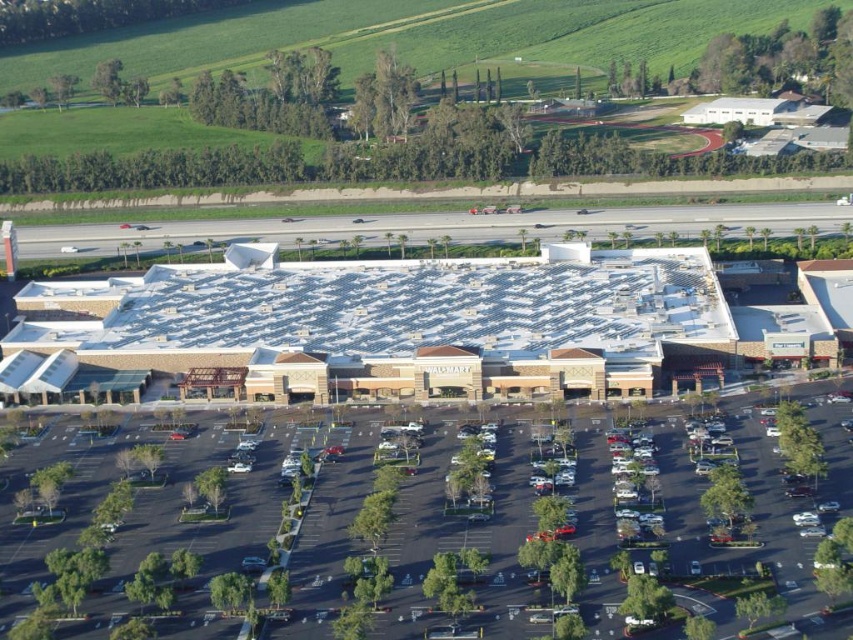
Question: Can you confirm if brown stone building at center is smaller than black asphalt parking lot at center?

Choices:
 (A) no
 (B) yes

Answer: (A)

Question: Which point is closer to the camera taking this photo?

Choices:
 (A) (672, 220)
 (B) (155, 497)
 (C) (193, 307)

Answer: (B)

Question: Among these objects, which one is farthest from the camera?

Choices:
 (A) brown stone building at center
 (B) black asphalt parking lot at center
 (C) dark gray asphalt parking lot at center

Answer: (C)

Question: Does brown stone building at center lie behind black asphalt parking lot at center?

Choices:
 (A) yes
 (B) no

Answer: (A)

Question: Which point appears closest to the camera in this image?

Choices:
 (A) (281, 376)
 (B) (665, 205)
 (C) (677, 513)

Answer: (C)

Question: Can you confirm if brown stone building at center is smaller than black asphalt parking lot at center?

Choices:
 (A) no
 (B) yes

Answer: (A)